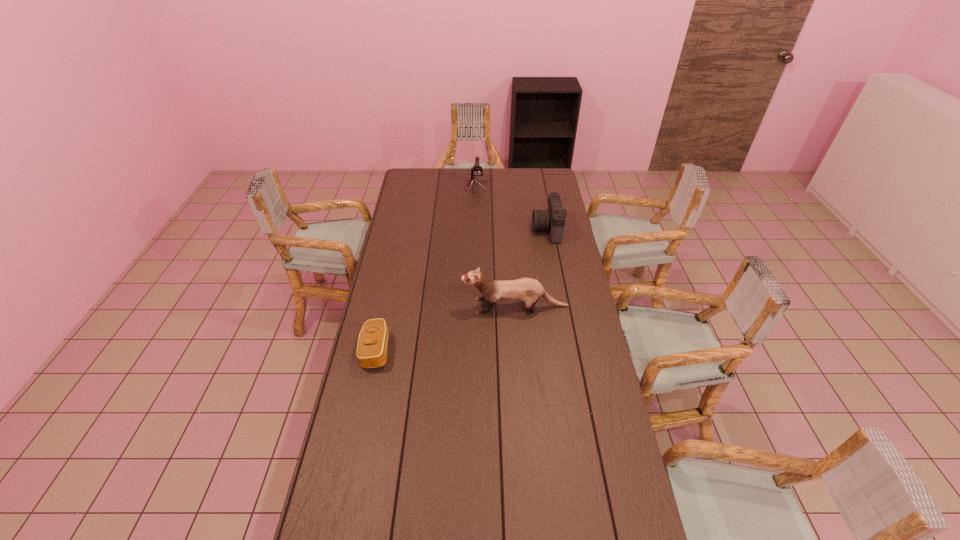
Where is `ferret`? Image resolution: width=960 pixels, height=540 pixels. ferret is located at coordinates (527, 290).

At what (x,y) coordinates should I click in order to perform the action: click on earphone. Please return your answer as a coordinate pair (x, y). This screenshot has height=540, width=960. Looking at the image, I should click on click(476, 171).

Where is `the second farthest object`? This screenshot has width=960, height=540. the second farthest object is located at coordinates (553, 219).

Find the location of `the leftmost object`. the leftmost object is located at coordinates (372, 347).

The height and width of the screenshot is (540, 960). Find the location of `clutch bag`. clutch bag is located at coordinates (372, 347).

Where is `free space located 0.130m on the face of the ferret`? free space located 0.130m on the face of the ferret is located at coordinates (431, 306).

The height and width of the screenshot is (540, 960). Find the location of `free spot located on the face of the ferret`. free spot located on the face of the ferret is located at coordinates (410, 306).

The image size is (960, 540). I want to click on vacant point located on the face of the ferret, so click(429, 306).

I want to click on vacant region located 0.370m on the front of the farthest object, so click(x=474, y=233).

What are the coordinates of `free point located at the lens of the third nearest object` in the screenshot? It's located at (522, 230).